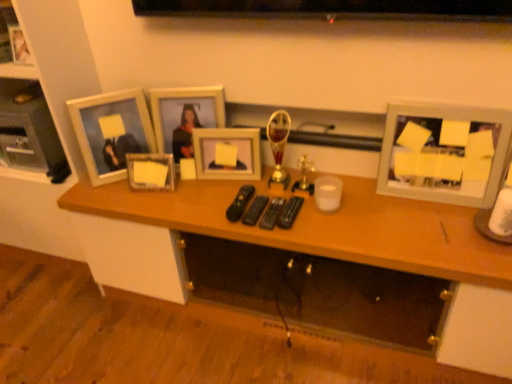
Where is `free location in front of black plastic remote control at center, the 2th remote control when ordered from right to left`? free location in front of black plastic remote control at center, the 2th remote control when ordered from right to left is located at coordinates (290, 234).